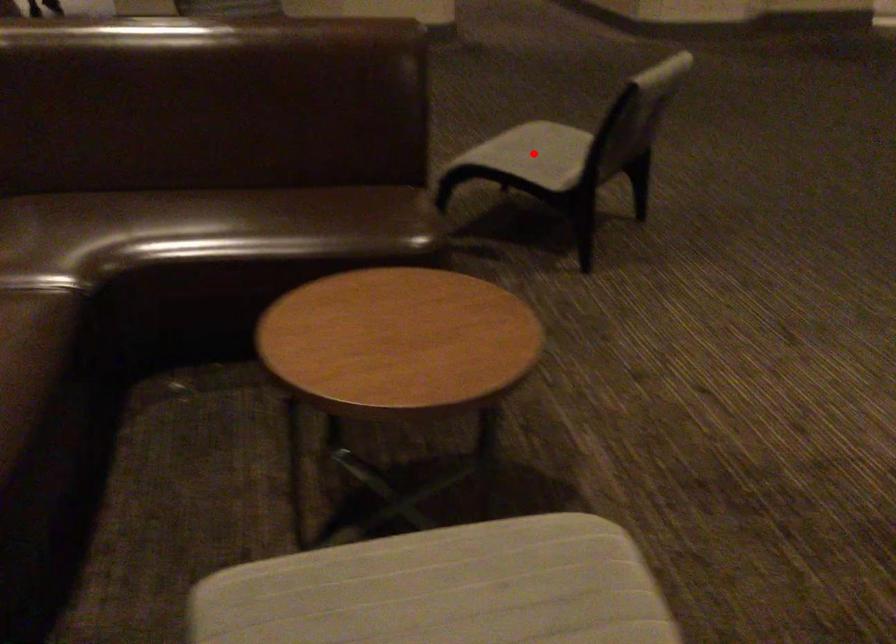
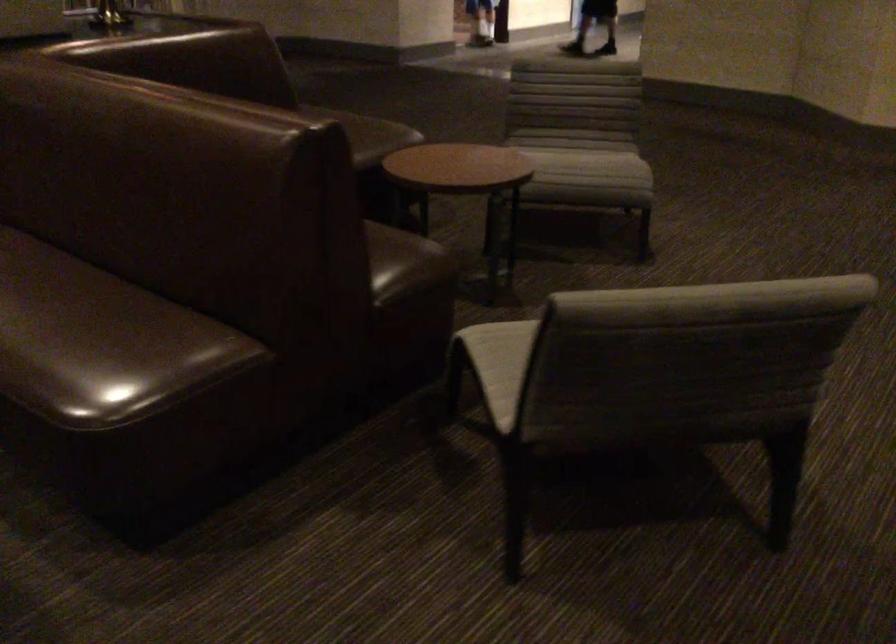
Question: I am providing you with two images of the same scene from different viewpoints. A red point is marked on the first image. Can you still see the location of the red point in image 2?

Choices:
 (A) Yes
 (B) No

Answer: (B)